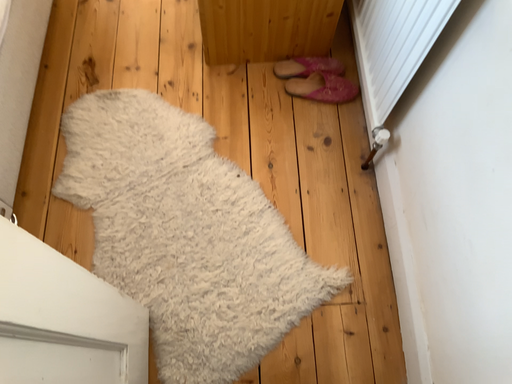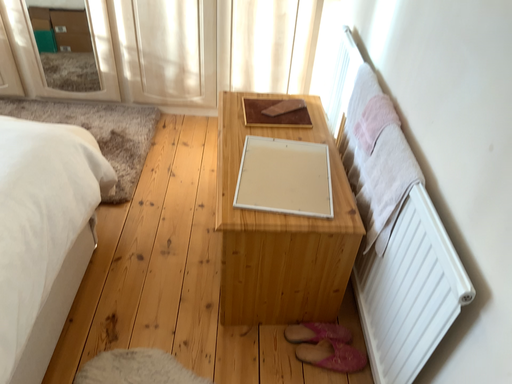
Question: How did the camera likely rotate when shooting the video?

Choices:
 (A) rotated upward
 (B) rotated downward

Answer: (A)